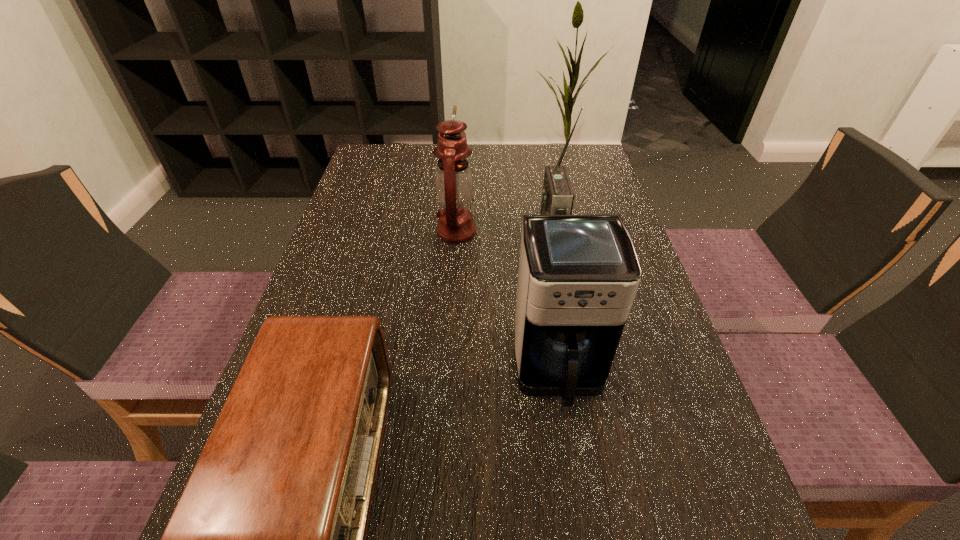
Locate an element on the screen. vacant region at the far edge of the desktop is located at coordinates (484, 176).

In the image, there is a desktop. Where is `free space at the left edge`? free space at the left edge is located at coordinates (348, 223).

This screenshot has width=960, height=540. In the image, there is a desktop. What are the coordinates of `free region at the right edge` in the screenshot? It's located at (579, 207).

Where is `vacant space at the far left corner of the desktop`? vacant space at the far left corner of the desktop is located at coordinates (363, 176).

In the image, there is a desktop. Identify the location of vacant space at the far right corner. coord(553,160).

This screenshot has height=540, width=960. I want to click on vacant space in between the oil lamp and the taller radio receiver, so click(x=504, y=234).

Where is `free spot between the coffee maker and the oil lamp`? The height and width of the screenshot is (540, 960). free spot between the coffee maker and the oil lamp is located at coordinates (508, 300).

At what (x,y) coordinates should I click in order to perform the action: click on vacant point located between the oil lamp and the coffee maker. Please return your answer as a coordinate pair (x, y). Image resolution: width=960 pixels, height=540 pixels. Looking at the image, I should click on (508, 300).

This screenshot has height=540, width=960. In order to click on object that is the third closest one to the oil lamp in this screenshot , I will do `click(268, 539)`.

Identify which object is the second closest to the right radio receiver. Please provide its 2D coordinates. Your answer should be formatted as a tuple, i.e. [(x, y)], where the tuple contains the x and y coordinates of a point satisfying the conditions above.

[(578, 275)]